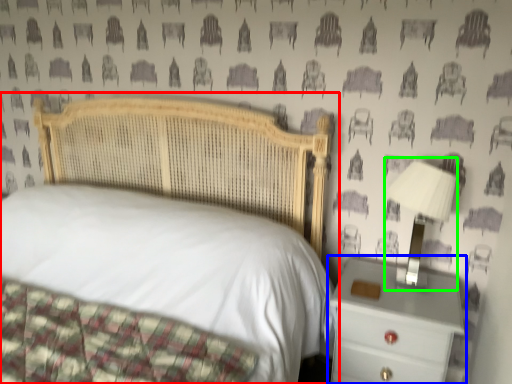
Question: Which object is the farthest from bed (highlighted by a red box)? Choose among these: nightstand (highlighted by a blue box) or bedside lamp (highlighted by a green box).

Choices:
 (A) nightstand
 (B) bedside lamp

Answer: (B)